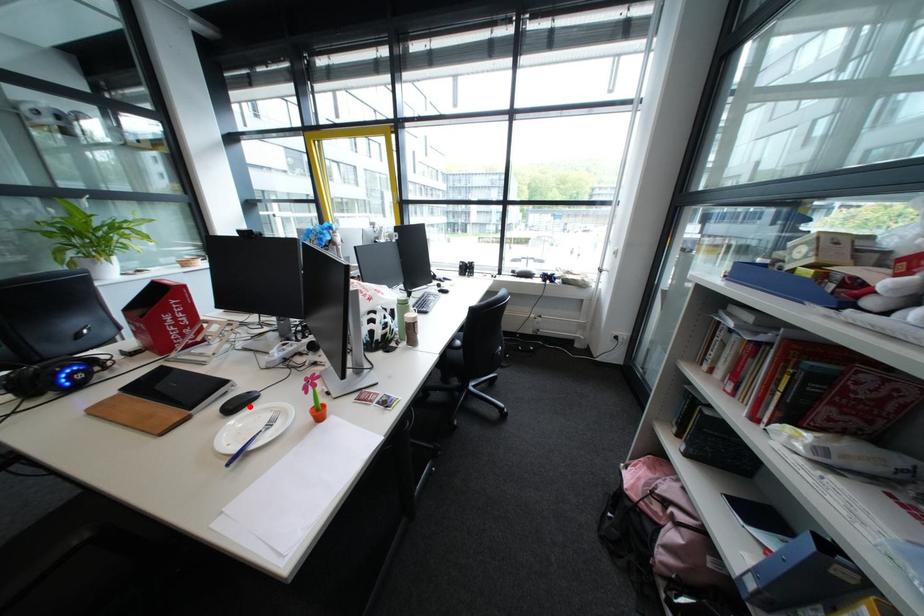
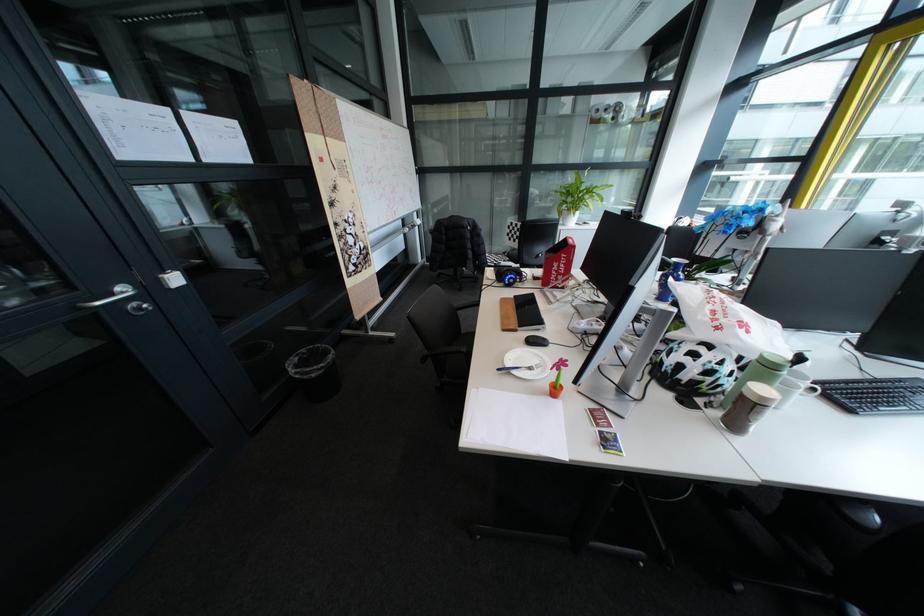
Find the pixel in the second image that matches the highlighted location in the first image.

(546, 342)